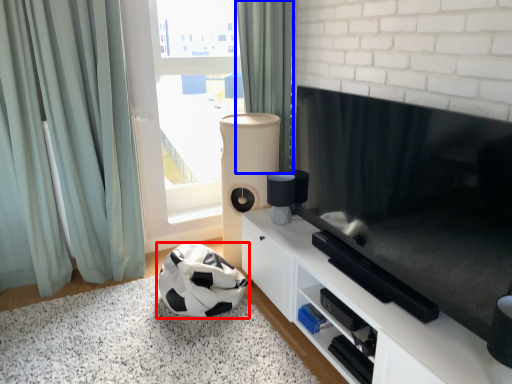
Question: Which point is further to the camera, football (highlighted by a red box) or curtain (highlighted by a blue box)?

Choices:
 (A) football
 (B) curtain

Answer: (B)